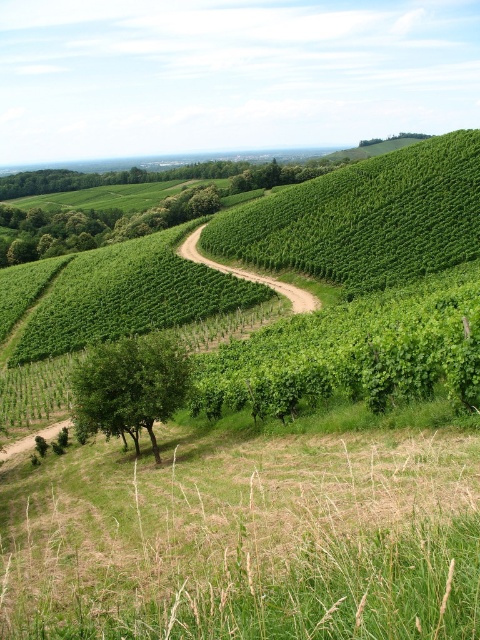
Is green leafy tree at lower left to the left of dirt/path at center from the viewer's perspective?

Indeed, green leafy tree at lower left is positioned on the left side of dirt/path at center.

Is green leafy tree at lower left thinner than dirt/path at center?

Indeed, green leafy tree at lower left has a lesser width compared to dirt/path at center.

Where is `green leafy tree at lower left`? green leafy tree at lower left is located at coordinates (130, 387).

Image resolution: width=480 pixels, height=640 pixels. I want to click on green leafy tree at lower left, so click(130, 387).